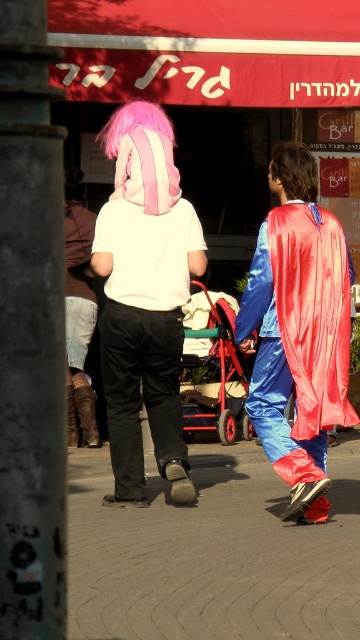
In the scene shown: Does white cotton t-shirt at center appear on the left side of metallic red baby carriage at center?

Yes, white cotton t-shirt at center is to the left of metallic red baby carriage at center.

Is white cotton t-shirt at center thinner than metallic red baby carriage at center?

No, white cotton t-shirt at center is not thinner than metallic red baby carriage at center.

Measure the distance between point (140, 346) and camera.

5.59 meters

Where is `white cotton t-shirt at center`? Image resolution: width=360 pixels, height=640 pixels. white cotton t-shirt at center is located at coordinates (145, 304).

The height and width of the screenshot is (640, 360). Describe the element at coordinates (213, 554) in the screenshot. I see `gray concrete pavement at center` at that location.

Is the position of gray concrete pavement at center less distant than that of leather boots at lower left?

Yes.

Who is more forward, [102,611] or [70,209]?

Point [102,611] is in front.

The width and height of the screenshot is (360, 640). I want to click on gray concrete pavement at center, so click(x=213, y=554).

Which is below, shiny blue cape at center or leather boots at lower left?

shiny blue cape at center

Between shiny blue cape at center and leather boots at lower left, which one is positioned higher?

Positioned higher is leather boots at lower left.

In the scene shown: Who is more distant from viewer, (281, 195) or (86, 416)?

Positioned behind is point (86, 416).

Identify the location of shiny blue cape at center. The height and width of the screenshot is (640, 360). (298, 330).